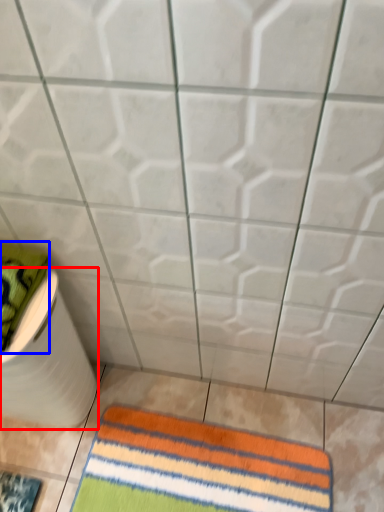
Question: Among these objects, which one is nearest to the camera, toilet paper (highlighted by a red box) or beach towel (highlighted by a blue box)?

Choices:
 (A) toilet paper
 (B) beach towel

Answer: (B)